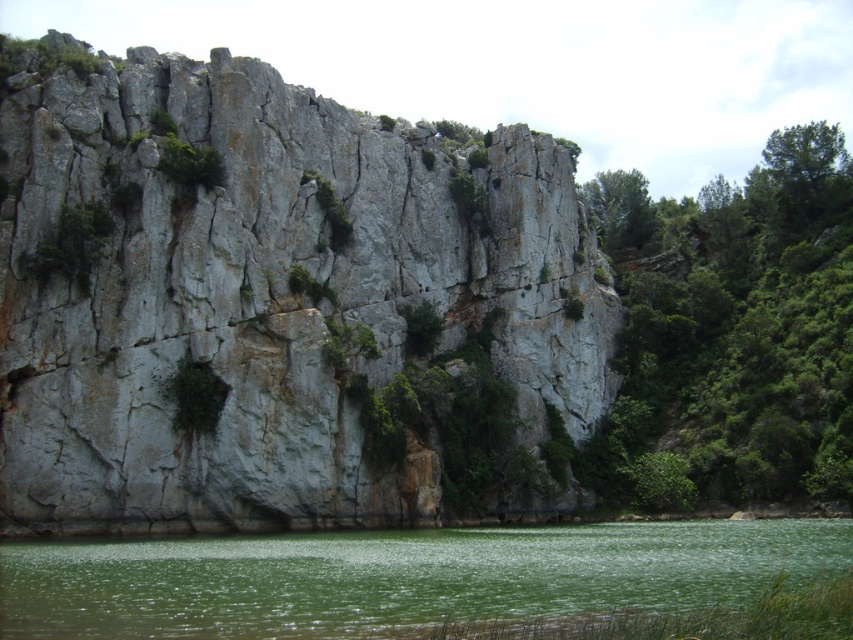
Measure the distance between gray rough rock face at center and camera.

gray rough rock face at center and camera are 236.87 feet apart.

From the picture: Can you confirm if gray rough rock face at center is positioned below green leafy tree at upper center?

Yes, gray rough rock face at center is below green leafy tree at upper center.

Find the location of a particular element. This screenshot has height=640, width=853. gray rough rock face at center is located at coordinates (280, 307).

Which is more to the right, green smooth water at lower center or green leafy tree at upper center?

From the viewer's perspective, green leafy tree at upper center appears more on the right side.

Does green smooth water at lower center have a smaller size compared to green leafy tree at upper center?

Correct, green smooth water at lower center occupies less space than green leafy tree at upper center.

Which is behind, point (764, 572) or point (602, 208)?

The point (602, 208) is more distant.

Locate an element on the screen. This screenshot has width=853, height=640. green smooth water at lower center is located at coordinates coord(399,577).

Is gray rough rock face at center shorter than green mossy rock at center?

Incorrect, gray rough rock face at center's height does not fall short of green mossy rock at center's.

Which is more to the right, gray rough rock face at center or green mossy rock at center?

gray rough rock face at center

Who is more distant from viewer, (x=564, y=154) or (x=339, y=204)?

The point (x=564, y=154) is behind.

This screenshot has width=853, height=640. In order to click on gray rough rock face at center in this screenshot , I will do `click(280, 307)`.